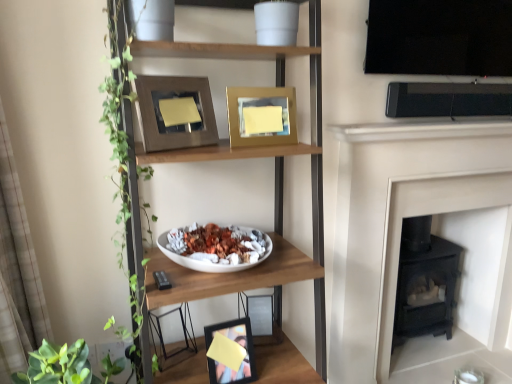
Question: From a real-world perspective, is gold metallic picture frame at upper center, which is the 2th picture frame from top to bottom, positioned under black matte fireplace at right based on gravity?

Choices:
 (A) no
 (B) yes

Answer: (A)

Question: Does gold metallic picture frame at upper center, acting as the third picture frame starting from the bottom, have a lesser width compared to black matte fireplace at right?

Choices:
 (A) no
 (B) yes

Answer: (A)

Question: Considering the relative sizes of gold metallic picture frame at upper center, acting as the third picture frame starting from the bottom, and black matte fireplace at right in the image provided, is gold metallic picture frame at upper center, acting as the third picture frame starting from the bottom, smaller than black matte fireplace at right?

Choices:
 (A) no
 (B) yes

Answer: (B)

Question: Does gold metallic picture frame at upper center, acting as the third picture frame starting from the bottom, come behind black matte fireplace at right?

Choices:
 (A) no
 (B) yes

Answer: (A)

Question: Is gold metallic picture frame at upper center, which is the 2th picture frame from top to bottom, in front of black matte fireplace at right?

Choices:
 (A) no
 (B) yes

Answer: (B)

Question: Considering the relative sizes of gold metallic picture frame at upper center, acting as the third picture frame starting from the bottom, and black matte fireplace at right in the image provided, is gold metallic picture frame at upper center, acting as the third picture frame starting from the bottom, taller than black matte fireplace at right?

Choices:
 (A) no
 (B) yes

Answer: (A)

Question: Can you confirm if black matte fireplace at right is positioned to the left of matte black picture frame at lower center, which is the 1th picture frame from bottom to top?

Choices:
 (A) yes
 (B) no

Answer: (B)

Question: Is black matte fireplace at right at the right side of matte black picture frame at lower center, which is the 1th picture frame from bottom to top?

Choices:
 (A) yes
 (B) no

Answer: (A)

Question: Can you confirm if black matte fireplace at right is smaller than matte black picture frame at lower center, which is the fourth picture frame in top-to-bottom order?

Choices:
 (A) no
 (B) yes

Answer: (A)

Question: Is black matte fireplace at right touching matte black picture frame at lower center, which is the fourth picture frame in top-to-bottom order?

Choices:
 (A) no
 (B) yes

Answer: (A)

Question: Would you say black matte fireplace at right is a long distance from matte black picture frame at lower center, which is the 1th picture frame from bottom to top?

Choices:
 (A) yes
 (B) no

Answer: (B)

Question: Is the position of black matte fireplace at right less distant than that of matte black picture frame at lower center, which is the fourth picture frame in top-to-bottom order?

Choices:
 (A) no
 (B) yes

Answer: (A)

Question: Is matte black picture frame at lower center, which is the fourth picture frame in top-to-bottom order, further to camera compared to black matte fireplace at right?

Choices:
 (A) yes
 (B) no

Answer: (B)